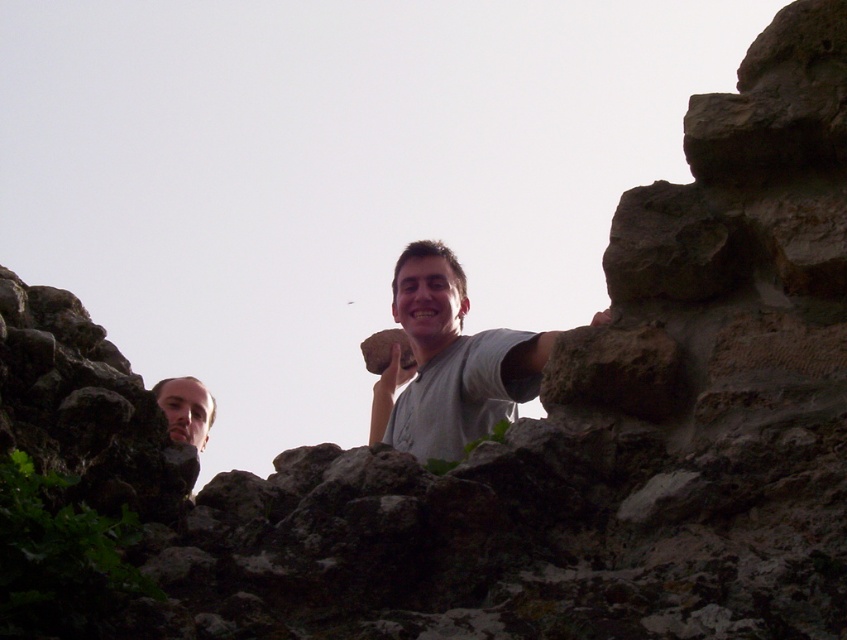
Question: Does dark gray stone at lower left come behind brown rough rock at center?

Choices:
 (A) no
 (B) yes

Answer: (A)

Question: Among these points, which one is farthest from the camera?

Choices:
 (A) (48, 449)
 (B) (438, 340)
 (C) (184, 433)

Answer: (B)

Question: Does dark gray stone at lower left appear under brown rough rock at center?

Choices:
 (A) yes
 (B) no

Answer: (A)

Question: Which point is closer to the camera?

Choices:
 (A) brown rough rock at center
 (B) gray matte t-shirt at center
 (C) smooth skin face at lower left
 (D) dark gray stone at lower left

Answer: (D)

Question: Estimate the real-world distances between objects in this image. Which object is farther from the gray matte t-shirt at center?

Choices:
 (A) dark gray stone at lower left
 (B) smooth skin face at lower left

Answer: (A)

Question: Considering the relative positions of dark gray stone at lower left and smooth skin face at lower left in the image provided, where is dark gray stone at lower left located with respect to smooth skin face at lower left?

Choices:
 (A) below
 (B) above

Answer: (B)